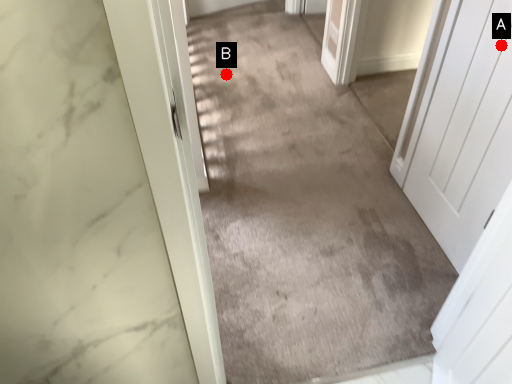
Question: Two points are circled on the image, labeled by A and B beside each circle. Among these points, which one is farthest from the camera?

Choices:
 (A) A is further
 (B) B is further

Answer: (B)